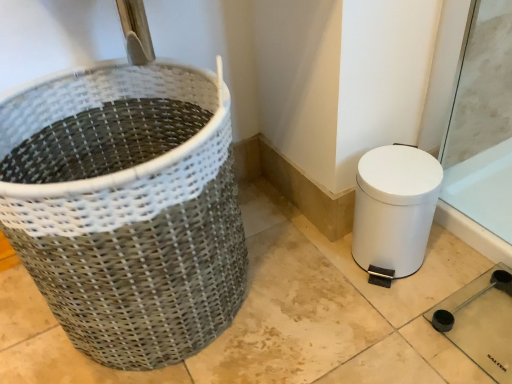
Locate an element on the screen. This screenshot has width=512, height=384. vacant area located to the right-hand side of white matte toilet bowl at lower right is located at coordinates (454, 263).